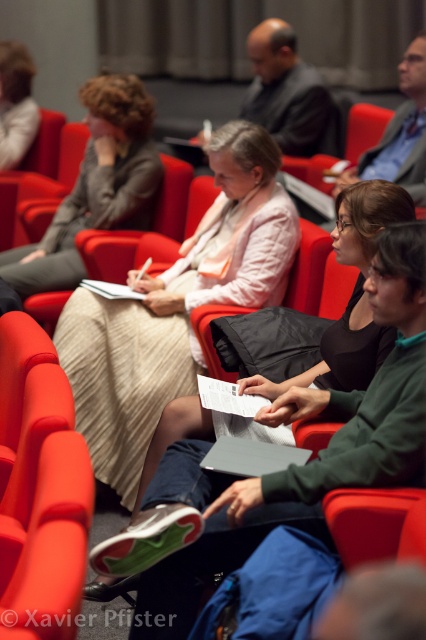
Who is positioned more to the right, matte black jacket at center or white fabric shirt at upper left?

Positioned to the right is matte black jacket at center.

Is point (175, 426) less distant than point (28, 93)?

Yes, it is.

Is point (391, 330) behind point (2, 77)?

No, (391, 330) is closer to viewer.

This screenshot has height=640, width=426. What are the coordinates of `matte black jacket at center` in the screenshot? It's located at (351, 296).

Can you confirm if light beige skirt at center is positioned below matte black jacket at upper center?

Yes, light beige skirt at center is below matte black jacket at upper center.

Which of these two, light beige skirt at center or matte black jacket at upper center, stands taller?

Standing taller between the two is light beige skirt at center.

Is point (86, 384) positioned in front of point (409, 99)?

Yes, it is.

This screenshot has height=640, width=426. Identify the location of light beige skirt at center. (176, 307).

Is light beige skirt at center above matte red chair at center?

Actually, light beige skirt at center is below matte red chair at center.

Which is behind, point (250, 266) or point (166, 198)?

Positioned behind is point (166, 198).

Locate an element on the screen. The image size is (426, 640). light beige skirt at center is located at coordinates (176, 307).